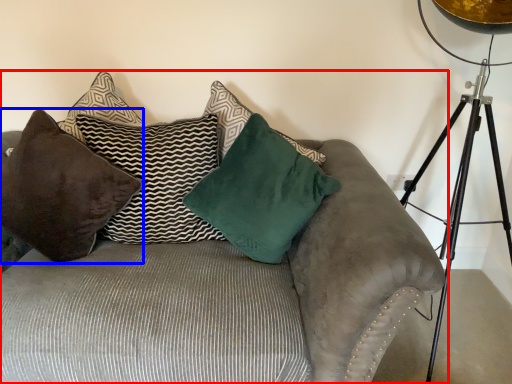
Question: Among these objects, which one is farthest to the camera, studio couch (highlighted by a red box) or pillow (highlighted by a blue box)?

Choices:
 (A) studio couch
 (B) pillow

Answer: (B)